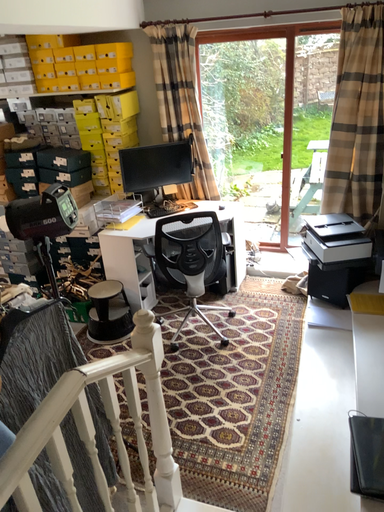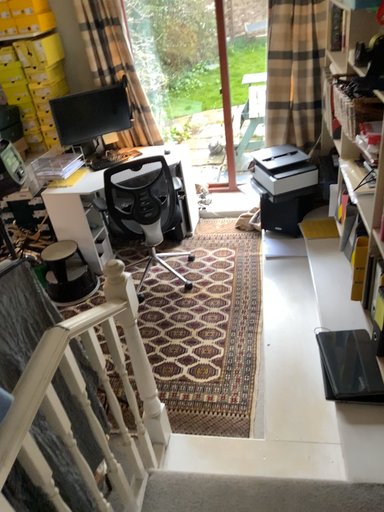
Question: Which way did the camera rotate in the video?

Choices:
 (A) rotated downward
 (B) rotated upward

Answer: (A)